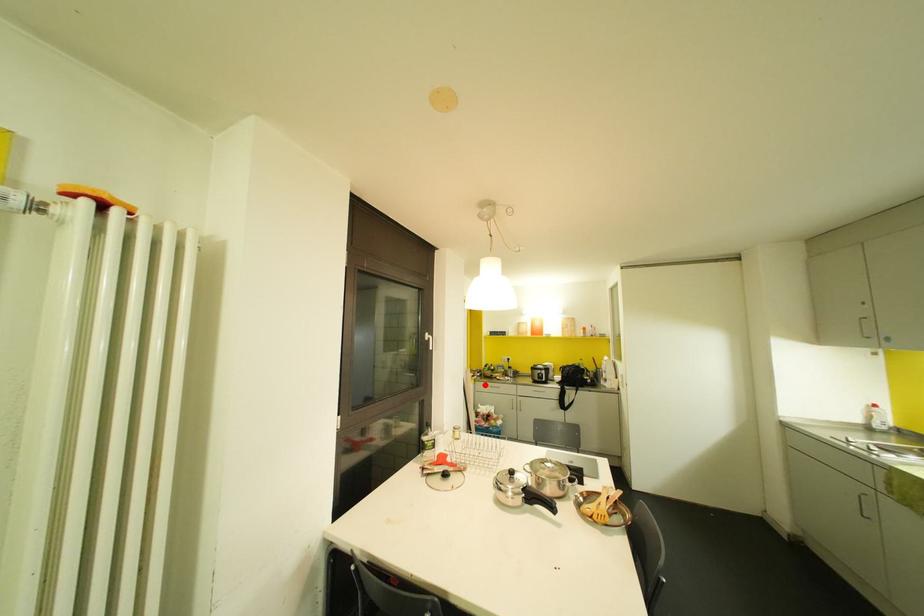
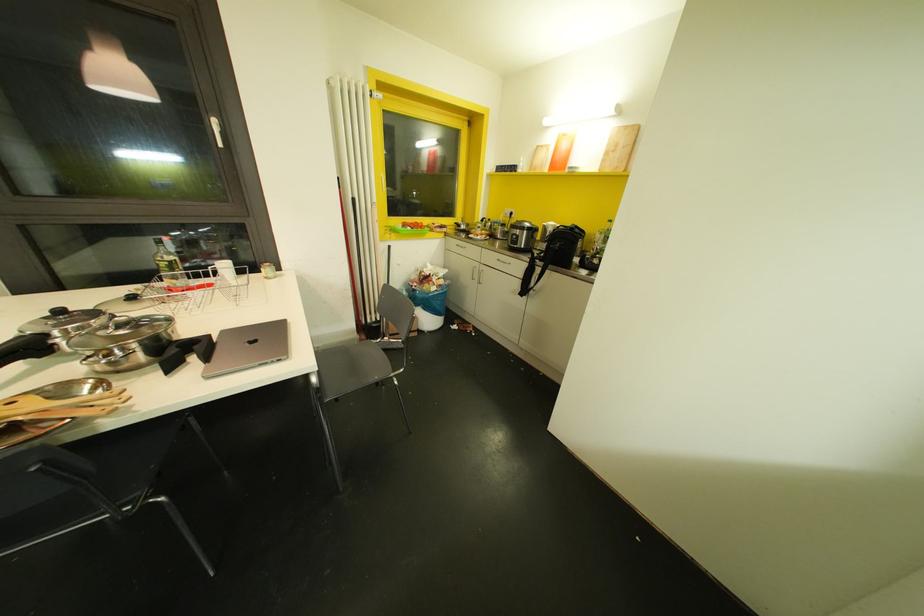
Where in the second image is the point corresponding to the highlighted location from the first image?

(453, 243)